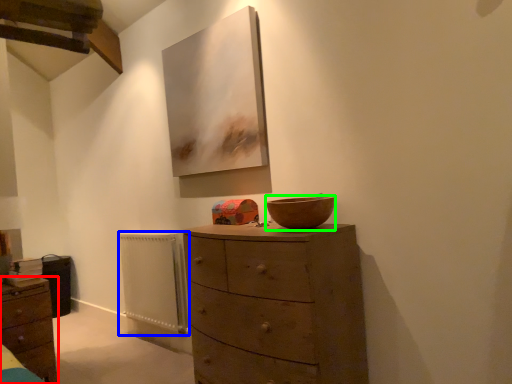
Question: Considering the real-world distances, which object is farthest from chest of drawers (highlighted by a red box)? radiator (highlighted by a blue box) or bowl (highlighted by a green box)?

Choices:
 (A) radiator
 (B) bowl

Answer: (B)